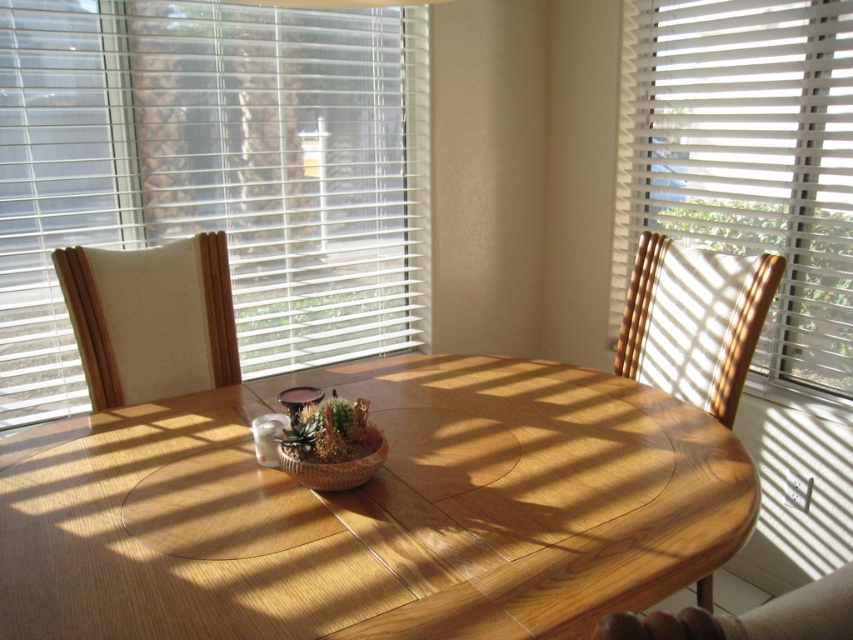
Where is `white blinds at upper left`? The image size is (853, 640). white blinds at upper left is located at coordinates (213, 176).

Measure the distance between white blinds at upper left and white fabric chair at left.

21.03 inches

Is point (230, 52) behind point (114, 371)?

Yes.

Locate an element on the screen. The height and width of the screenshot is (640, 853). white blinds at upper left is located at coordinates (213, 176).

Is white/smooth blinds at right thinner than transparent glass vase at center?

In fact, white/smooth blinds at right might be wider than transparent glass vase at center.

Who is more distant from viewer, [846,387] or [369,422]?

The point [846,387] is behind.

Who is more distant from viewer, (767, 134) or (344, 444)?

The point (767, 134) is more distant.

This screenshot has height=640, width=853. Identify the location of white/smooth blinds at right. (746, 157).

Who is taller, white fabric chair at left or wooden chair at right?

With more height is wooden chair at right.

Can you confirm if white fabric chair at left is taller than wooden chair at right?

In fact, white fabric chair at left may be shorter than wooden chair at right.

Where is `white fabric chair at left`? The height and width of the screenshot is (640, 853). white fabric chair at left is located at coordinates (151, 317).